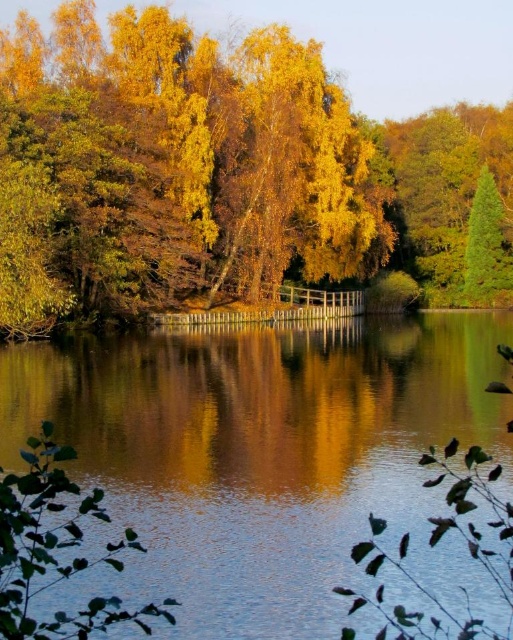
Question: Is yellow leafy tree at upper center smaller than transparent water at center?

Choices:
 (A) no
 (B) yes

Answer: (A)

Question: Does yellow leafy tree at upper center have a lesser width compared to transparent water at center?

Choices:
 (A) yes
 (B) no

Answer: (B)

Question: Which point is farther to the camera?

Choices:
 (A) (297, 272)
 (B) (483, 573)

Answer: (A)

Question: Can you confirm if yellow leafy tree at upper center is positioned above transparent water at center?

Choices:
 (A) no
 (B) yes

Answer: (B)

Question: Which of the following is the closest to the observer?

Choices:
 (A) transparent water at center
 (B) yellow leafy tree at upper center

Answer: (A)